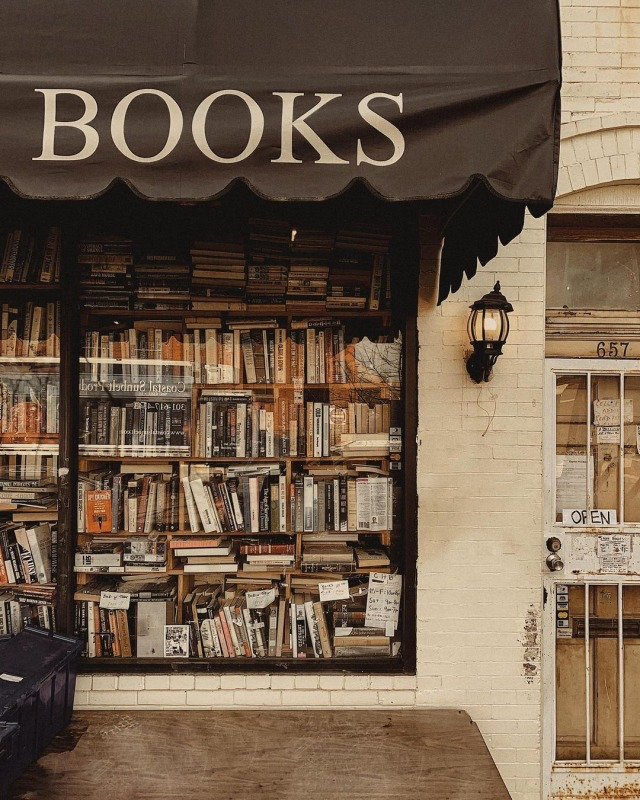
Where is `door`? door is located at coordinates (582, 554).